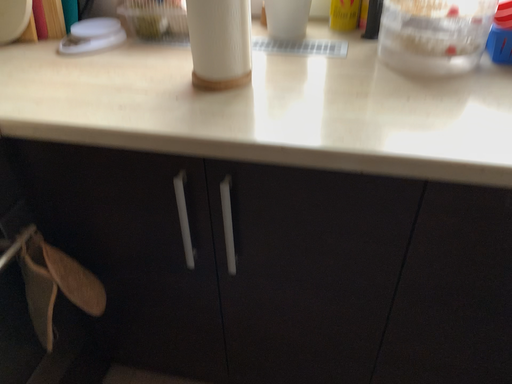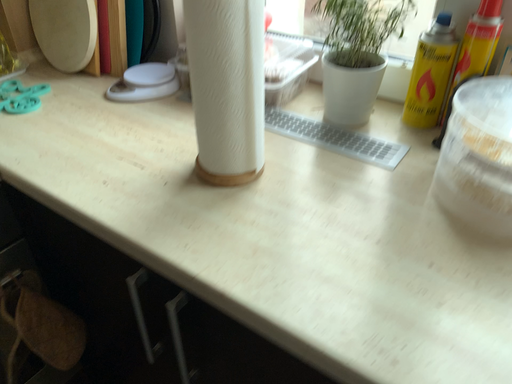
Question: Which way did the camera rotate in the video?

Choices:
 (A) rotated left
 (B) rotated right

Answer: (A)